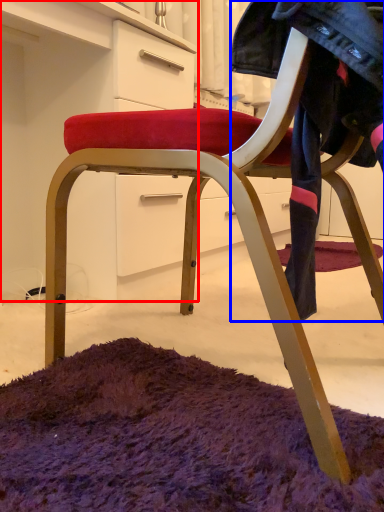
Question: Which of the following is the closest to the observer, dresser (highlighted by a red box) or clothing (highlighted by a blue box)?

Choices:
 (A) dresser
 (B) clothing

Answer: (B)